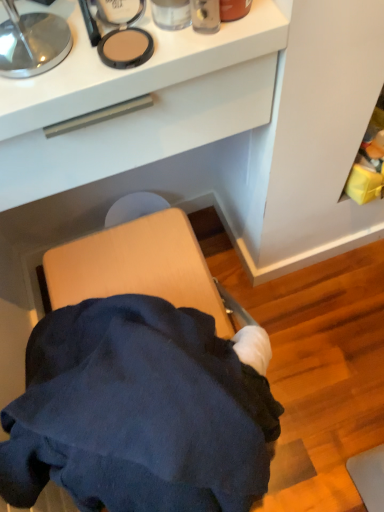
Question: Considering the relative sizes of white matte drawer at upper center and matte plastic container at upper center in the image provided, is white matte drawer at upper center bigger than matte plastic container at upper center?

Choices:
 (A) no
 (B) yes

Answer: (B)

Question: Is white matte drawer at upper center smaller than matte plastic container at upper center?

Choices:
 (A) yes
 (B) no

Answer: (B)

Question: From a real-world perspective, does white matte drawer at upper center sit lower than matte plastic container at upper center?

Choices:
 (A) no
 (B) yes

Answer: (B)

Question: Is white matte drawer at upper center outside matte plastic container at upper center?

Choices:
 (A) no
 (B) yes

Answer: (B)

Question: Would you say matte plastic container at upper center is part of white matte drawer at upper center's contents?

Choices:
 (A) yes
 (B) no

Answer: (B)

Question: From the image's perspective, is white matte drawer at upper center located above matte plastic container at upper center?

Choices:
 (A) yes
 (B) no

Answer: (B)

Question: Could you tell me if matte plastic container at upper center is facing white matte drawer at upper center?

Choices:
 (A) no
 (B) yes

Answer: (A)

Question: Can you confirm if matte plastic container at upper center is positioned to the left of white matte drawer at upper center?

Choices:
 (A) yes
 (B) no

Answer: (B)

Question: Is matte plastic container at upper center not inside white matte drawer at upper center?

Choices:
 (A) no
 (B) yes

Answer: (B)

Question: From the image's perspective, is matte plastic container at upper center over white matte drawer at upper center?

Choices:
 (A) no
 (B) yes

Answer: (B)

Question: Is matte plastic container at upper center positioned in front of white matte drawer at upper center?

Choices:
 (A) yes
 (B) no

Answer: (B)

Question: From a real-world perspective, does matte plastic container at upper center stand above white matte drawer at upper center?

Choices:
 (A) no
 (B) yes

Answer: (B)

Question: Is matte plastic container at upper center taller or shorter than white matte drawer at upper center?

Choices:
 (A) tall
 (B) short

Answer: (B)